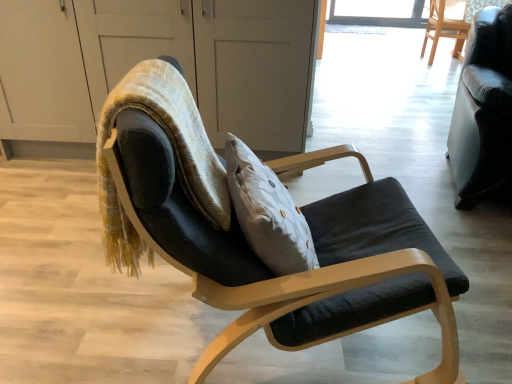
This screenshot has height=384, width=512. What do you see at coordinates (168, 149) in the screenshot?
I see `velvet textured bean bag chair at center` at bounding box center [168, 149].

I want to click on transparent glass screen door at upper center, so click(215, 60).

The width and height of the screenshot is (512, 384). What do you see at coordinates (215, 60) in the screenshot?
I see `transparent glass screen door at upper center` at bounding box center [215, 60].

Locate an element on the screen. This screenshot has height=384, width=512. wooden chair at upper right, arranged as the first chair when viewed from the back is located at coordinates (444, 30).

This screenshot has height=384, width=512. What do you see at coordinates (483, 112) in the screenshot? I see `black leather couch at right, which is counted as the 2th chair, starting from the back` at bounding box center [483, 112].

Image resolution: width=512 pixels, height=384 pixels. Identify the location of velvet textured bean bag chair at center. (168, 149).

How different are the orientations of velvet textured bean bag chair at center and transparent glass screen door at upper center in degrees?

The facing directions of velvet textured bean bag chair at center and transparent glass screen door at upper center are 98.2 degrees apart.

From a real-world perspective, is velvet textured bean bag chair at center on top of transparent glass screen door at upper center?

Yes, from a real-world perspective, velvet textured bean bag chair at center is over transparent glass screen door at upper center

At what (x,y) coordinates should I click in order to perform the action: click on bean bag chair on the right of transparent glass screen door at upper center. Please return your answer as a coordinate pair (x, y). This screenshot has width=512, height=384. Looking at the image, I should click on (168, 149).

Which is more to the right, velvet textured bean bag chair at center or transparent glass screen door at upper center?

Positioned to the right is velvet textured bean bag chair at center.

Between velvet textured bean bag chair at center and wooden chair at upper right, arranged as the first chair when viewed from the back, which one is positioned in front?

velvet textured bean bag chair at center is in front.

Which is more to the right, velvet textured bean bag chair at center or wooden chair at upper right, which is the third chair from front to back?

wooden chair at upper right, which is the third chair from front to back, is more to the right.

Identify the location of the 3rd chair to the right of the velvet textured bean bag chair at center, counting from the anchor's position. The image size is (512, 384). (444, 30).

Consider the image. Are velvet textured bean bag chair at center and wooden chair at upper right, positioned as the 1th chair in right-to-left order, beside each other?

No.

Based on the photo, from a real-world perspective, which object stands above the other?

velvet textured bean bag chair at center.

Looking at their sizes, would you say transparent glass screen door at upper center is wider or thinner than velvet textured bean bag chair at center?

Clearly, transparent glass screen door at upper center has more width compared to velvet textured bean bag chair at center.

From the image's perspective, is transparent glass screen door at upper center under velvet textured bean bag chair at center?

Actually, transparent glass screen door at upper center appears above velvet textured bean bag chair at center in the image.

The width and height of the screenshot is (512, 384). I want to click on bean bag chair below the transparent glass screen door at upper center (from the image's perspective), so click(x=168, y=149).

Considering the relative sizes of velvet textured bean bag chair at center and black leather couch at right, the second chair when ordered from bottom to top, in the image provided, is velvet textured bean bag chair at center taller than black leather couch at right, the second chair when ordered from bottom to top,?

Incorrect, the height of velvet textured bean bag chair at center is not larger of that of black leather couch at right, the second chair when ordered from bottom to top.

Between velvet textured bean bag chair at center and black leather couch at right, which is the 2th chair from top to bottom, which one appears on the right side from the viewer's perspective?

black leather couch at right, which is the 2th chair from top to bottom.

Between point (105, 248) and point (495, 95), which one is positioned in front?

The point (105, 248) is more forward.

Is velvet textured bean bag chair at center far from black leather couch at right, the second chair when ordered from bottom to top?

Yes, velvet textured bean bag chair at center and black leather couch at right, the second chair when ordered from bottom to top, are located far from each other.

Which object is positioned more to the right, wooden chair at upper right, positioned as the 1th chair in right-to-left order, or velvet textured bean bag chair at center?

From the viewer's perspective, wooden chair at upper right, positioned as the 1th chair in right-to-left order, appears more on the right side.

How different are the orientations of wooden chair at upper right, positioned as the 1th chair in right-to-left order, and velvet textured bean bag chair at center in degrees?

The facing directions of wooden chair at upper right, positioned as the 1th chair in right-to-left order, and velvet textured bean bag chair at center are 8.58 degrees apart.

Is wooden chair at upper right, the 3th chair from the bottom, wider or thinner than velvet textured bean bag chair at center?

wooden chair at upper right, the 3th chair from the bottom, is wider than velvet textured bean bag chair at center.

Is wooden chair at upper right, which is the first chair from top to bottom, bigger than velvet textured bean bag chair at center?

Yes.

Between black leather couch at right, the second chair when ordered from bottom to top, and transparent glass screen door at upper center, which one appears on the right side from the viewer's perspective?

Positioned to the right is black leather couch at right, the second chair when ordered from bottom to top.

Is black leather couch at right, placed as the 2th chair when sorted from left to right, not close to transparent glass screen door at upper center?

Yes.

Which object is more forward, black leather couch at right, placed as the 2th chair when sorted from left to right, or transparent glass screen door at upper center?

black leather couch at right, placed as the 2th chair when sorted from left to right, is more forward.

How different are the orientations of black leather couch at right, placed as the 2th chair when sorted from left to right, and transparent glass screen door at upper center in degrees?

The angular difference between black leather couch at right, placed as the 2th chair when sorted from left to right, and transparent glass screen door at upper center is 12.2 degrees.

Between transparent glass screen door at upper center and wooden chair at upper right, which is the first chair from top to bottom, which one appears on the left side from the viewer's perspective?

Positioned to the left is transparent glass screen door at upper center.

Is transparent glass screen door at upper center aimed at wooden chair at upper right, arranged as the first chair when viewed from the back?

No, transparent glass screen door at upper center does not turn towards wooden chair at upper right, arranged as the first chair when viewed from the back.

This screenshot has height=384, width=512. Find the location of `the 3rd chair to the right when counting from the transparent glass screen door at upper center`. the 3rd chair to the right when counting from the transparent glass screen door at upper center is located at coordinates (444, 30).

From a real-world perspective, relative to wooden chair at upper right, the 3th chair from the bottom, is transparent glass screen door at upper center vertically above or below?

Clearly, from a real-world perspective, transparent glass screen door at upper center is above wooden chair at upper right, the 3th chair from the bottom.

This screenshot has width=512, height=384. I want to click on bean bag chair in front of the transparent glass screen door at upper center, so click(x=168, y=149).

Identify the location of bean bag chair below the wooden chair at upper right, positioned as the 1th chair in right-to-left order (from the image's perspective). This screenshot has height=384, width=512. (168, 149).

Looking at the image, which one is located further to matte black chair at center, which is the 1th chair from front to back, wooden chair at upper right, which is the third chair from front to back, or black leather couch at right, which is the 2th chair in right-to-left order?

The object further to matte black chair at center, which is the 1th chair from front to back, is wooden chair at upper right, which is the third chair from front to back.

When comparing their distances from transparent glass screen door at upper center, does black leather couch at right, which is counted as the 2th chair, starting from the back, or velvet textured bean bag chair at center seem further?

velvet textured bean bag chair at center is positioned further to the anchor transparent glass screen door at upper center.

Which object lies further to the anchor point wooden chair at upper right, the 3th chair when ordered from left to right, velvet textured bean bag chair at center or black leather couch at right, which is the 2th chair in right-to-left order?

velvet textured bean bag chair at center is positioned further to the anchor wooden chair at upper right, the 3th chair when ordered from left to right.

Estimate the real-world distances between objects in this image. Which object is closer to black leather couch at right, which appears as the second chair when viewed from the front, matte black chair at center, which is the 1th chair from front to back, or wooden chair at upper right, which is the first chair from top to bottom?

matte black chair at center, which is the 1th chair from front to back, is closer to black leather couch at right, which appears as the second chair when viewed from the front.

Which object lies further to the anchor point transparent glass screen door at upper center, black leather couch at right, which is the 2th chair from top to bottom, or matte black chair at center, which appears as the 1th chair when viewed from the left?

matte black chair at center, which appears as the 1th chair when viewed from the left, is positioned further to the anchor transparent glass screen door at upper center.

Based on their spatial positions, is matte black chair at center, acting as the third chair starting from the top, or black leather couch at right, which appears as the second chair when viewed from the front, further from wooden chair at upper right, which is the first chair from top to bottom?

matte black chair at center, acting as the third chair starting from the top.

Based on their spatial positions, is wooden chair at upper right, the 3th chair when ordered from left to right, or matte black chair at center, which is the 1th chair from front to back, further from black leather couch at right, which is the 2th chair in right-to-left order?

Among the two, wooden chair at upper right, the 3th chair when ordered from left to right, is located further to black leather couch at right, which is the 2th chair in right-to-left order.

Looking at this image, based on their spatial positions, is wooden chair at upper right, the 3th chair from the bottom, or matte black chair at center, which is the 1th chair from front to back, further from transparent glass screen door at upper center?

Among the two, wooden chair at upper right, the 3th chair from the bottom, is located further to transparent glass screen door at upper center.

Where is `chair between velvet textured bean bag chair at center and black leather couch at right, the second chair when ordered from bottom to top`? chair between velvet textured bean bag chair at center and black leather couch at right, the second chair when ordered from bottom to top is located at coordinates (270, 270).

Find the location of a particular element. chair situated between transparent glass screen door at upper center and black leather couch at right, which appears as the second chair when viewed from the front, from left to right is located at coordinates tap(270, 270).

The width and height of the screenshot is (512, 384). I want to click on screen door between matte black chair at center, which is the 1th chair from front to back, and wooden chair at upper right, the 3th chair from the bottom, from front to back, so click(215, 60).

Image resolution: width=512 pixels, height=384 pixels. I want to click on bean bag chair between transparent glass screen door at upper center and black leather couch at right, placed as the 2th chair when sorted from left to right, from left to right, so point(168,149).